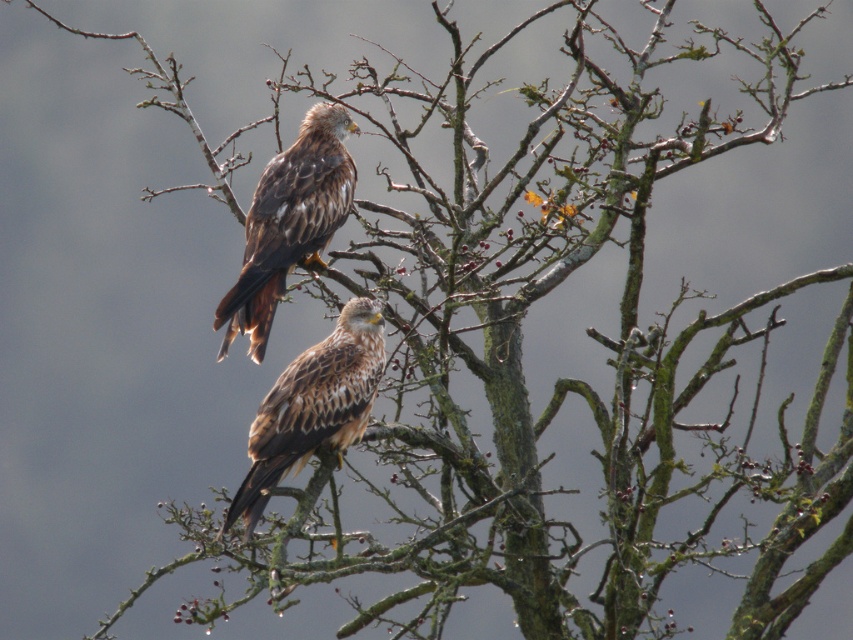
You are a birdwatcher observing two points where birds are perched on a tree branch. The points are labeled as point 1 at coordinates (254, 342) and point 2 at coordinates (331, 424). According to the image, which point is closer to you?

Point 1 at coordinates (254, 342) is closer to you because it is further to the viewer than point 2 at coordinates (331, 424).

You are a birdwatcher trying to identify two Red Kites perched on a tree branch. You notice both have brown speckled feathers at upper center and brown speckled feathers at center. Which of the two has smaller brown speckled feathers?

The brown speckled feathers at upper center has smaller width than brown speckled feathers at center, so the one at upper center has smaller brown speckled feathers.

You are a wildlife photographer aiming to capture a closeup of the brown speckled feathers at upper center. Your camera has a maximum zoom range of 10 meters. Can you get a clear closeup shot from your current position?

The distance between the brown speckled feathers at upper center and the camera is 9.57 meters, which is within the camera maximum zoom range of 10 meters. Therefore, you can get a clear closeup shot from your current position.